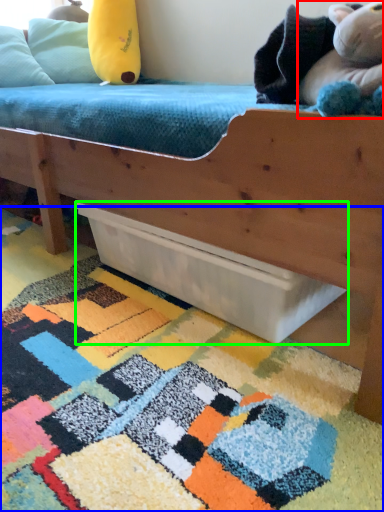
Question: Estimate the real-world distances between objects in this image. Which object is closer to toy (highlighted by a red box), mat (highlighted by a blue box) or drawer (highlighted by a green box)?

Choices:
 (A) mat
 (B) drawer

Answer: (B)